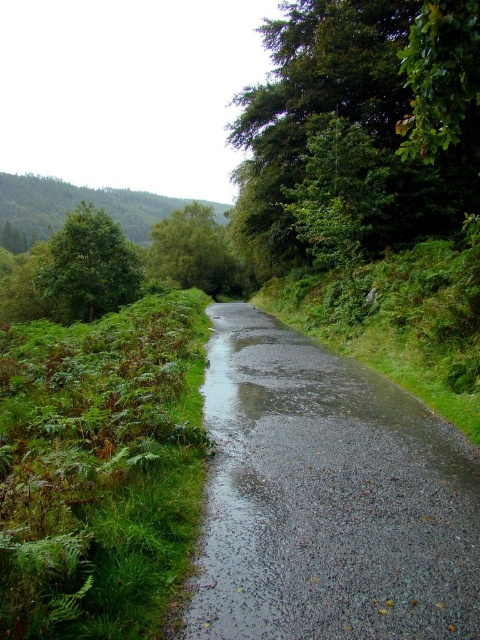
In the scene shown: You are a hiker planning to walk along the glossy asphalt road at center. There is a green leafy tree at upper right in the distance. From your perspective on the road, will the tree be visible above or below you?

The glossy asphalt road at center is located below the green leafy tree at upper right, so the tree will be visible above you as you walk along the road.

You are driving a car and see the green leafy tree at upper right and the green leafy tree at left from your current position. Which tree would appear closer to you?

The green leafy tree at left would appear closer because it is shorter than the green leafy tree at upper right, which is taller and further away.

You are driving along the narrow, wet road and see the green leafy tree at upper right and the green leafy tree at center. Which tree is positioned more to the right side of the road?

The green leafy tree at upper right is positioned more to the right side of the road compared to the green leafy tree at center.